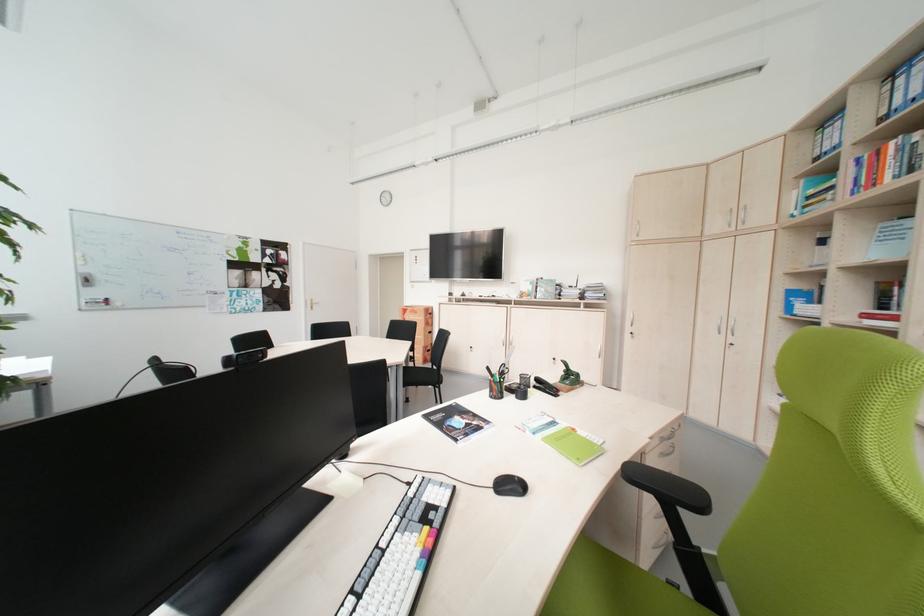
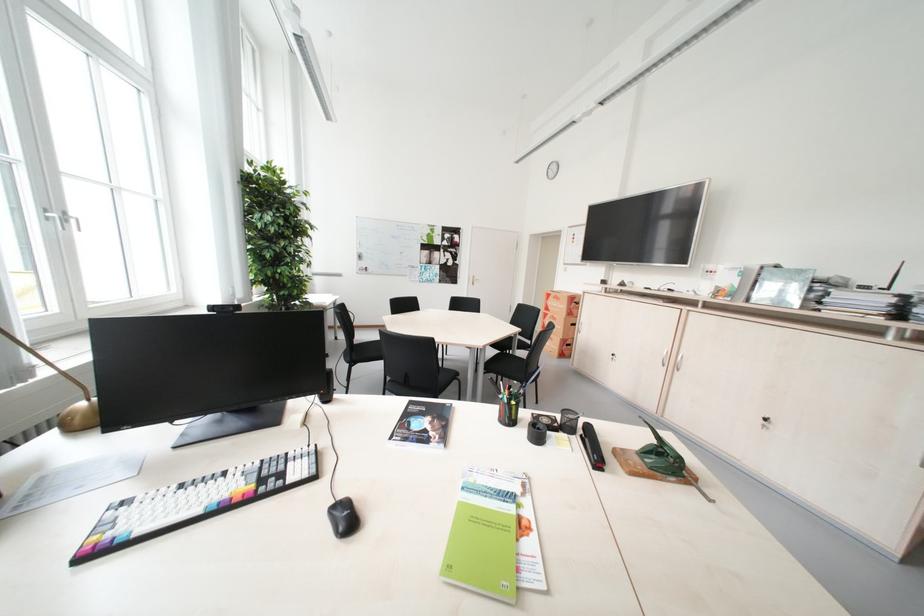
Find the pixel in the second image that matches [418,313] in the first image.

(561, 299)